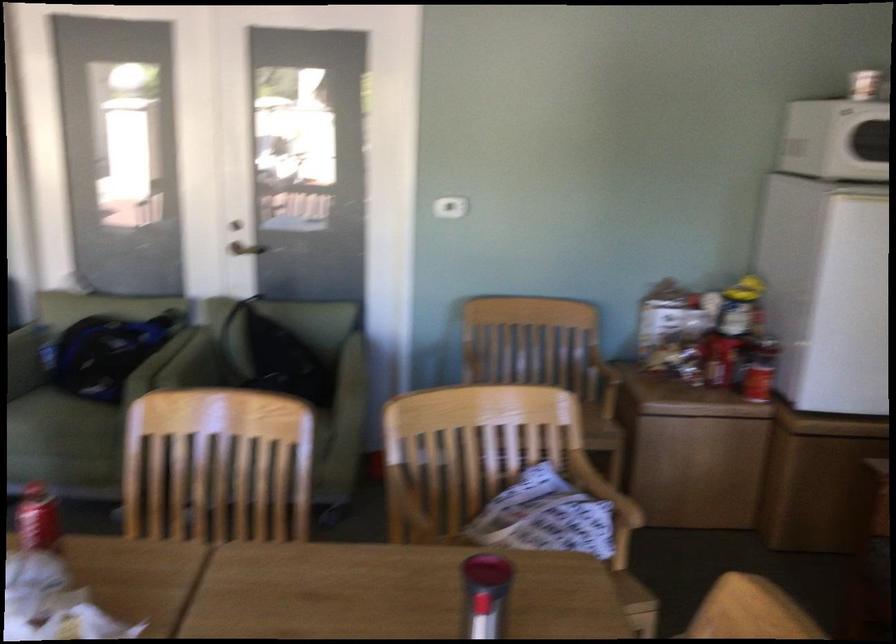
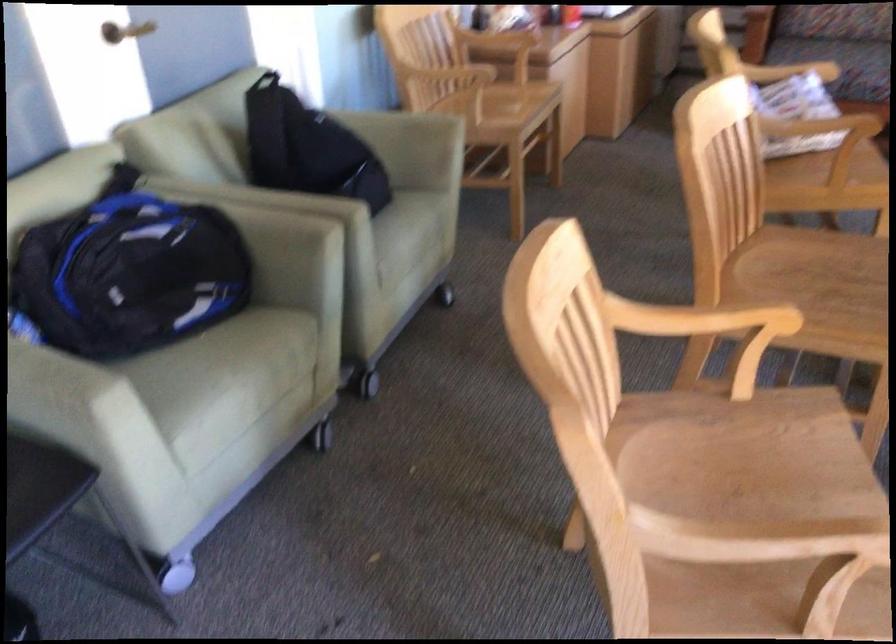
Locate, in the second image, the point that corresponds to (x=98, y=518) in the first image.

(321, 435)